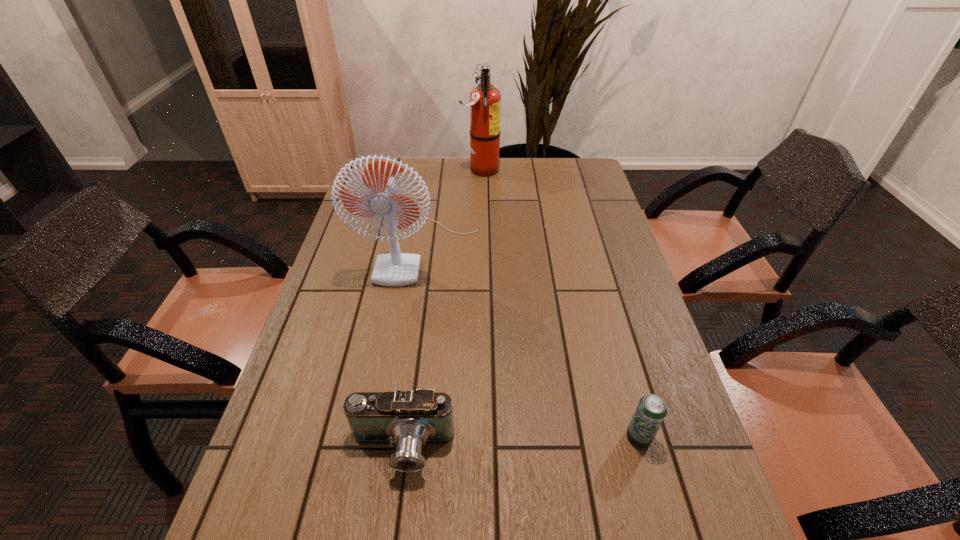
You are a GUI agent. You are given a task and a screenshot of the screen. Output one action in this format:
    pyautogui.click(x=<x>, y=<y>)
    Task: Click on the free point that satisfies the following two spatial constraints: 1. from the nozzle of the farthest object; 2. on the front-facing side of the camcorder
    
    Given the screenshot: What is the action you would take?
    pyautogui.click(x=480, y=449)